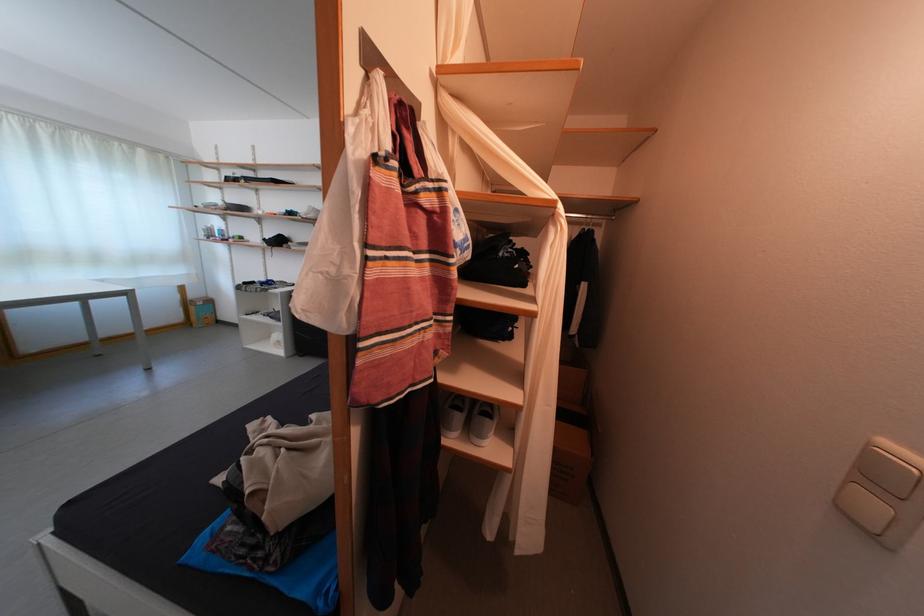
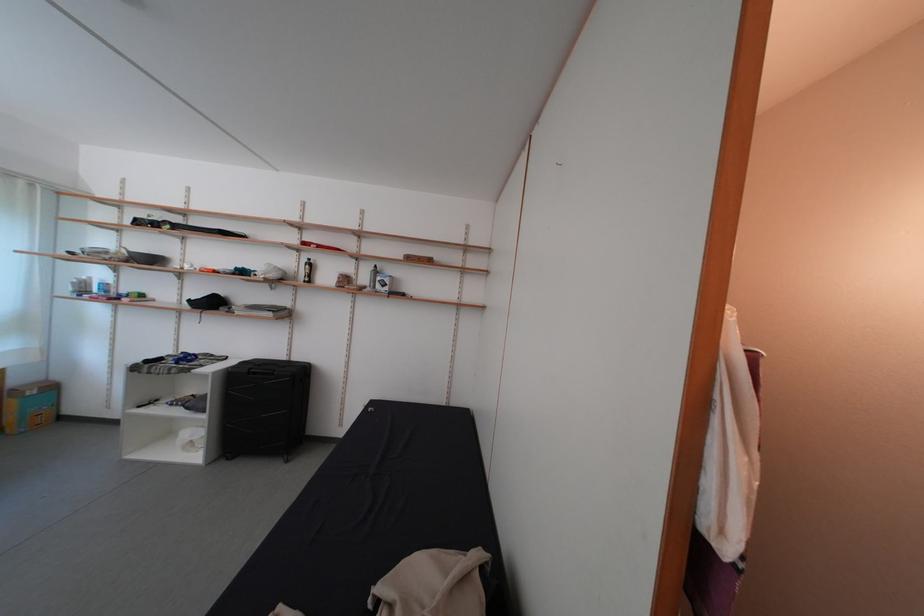
Question: The images are taken continuously from a first-person perspective. In which direction are you moving?

Choices:
 (A) Left
 (B) Right
 (C) Forward
 (D) Backward

Answer: (A)